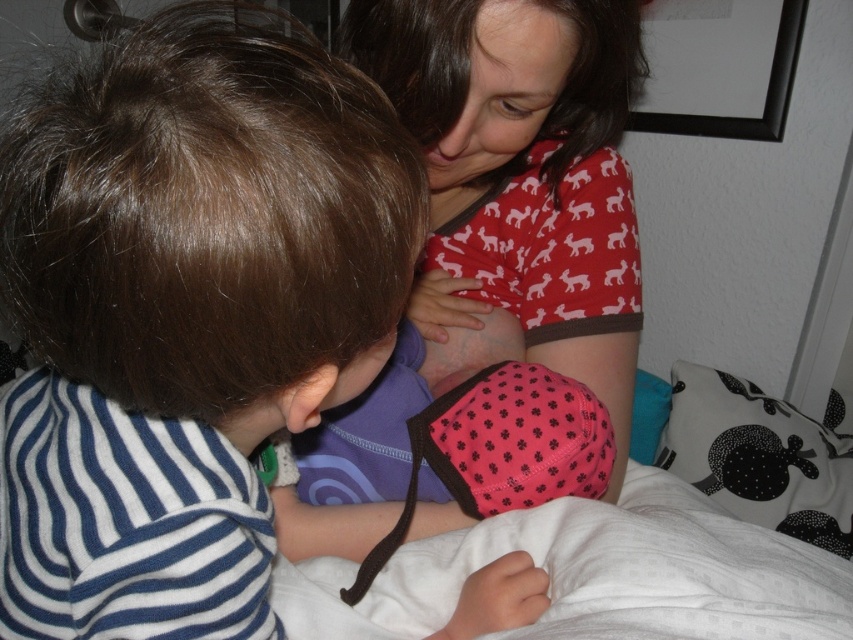
Question: Does striped cotton shirt at left have a smaller size compared to matte red shirt at upper center?

Choices:
 (A) no
 (B) yes

Answer: (B)

Question: Which of the following is the closest to the observer?

Choices:
 (A) (650, 428)
 (B) (477, 8)

Answer: (B)

Question: Can you confirm if matte red shirt at upper center is positioned above white fabric pillow at lower right?

Choices:
 (A) yes
 (B) no

Answer: (A)

Question: Is striped cotton shirt at left wider than matte red shirt at upper center?

Choices:
 (A) yes
 (B) no

Answer: (A)

Question: Which object is the farthest from the matte red shirt at upper center?

Choices:
 (A) white fabric pillow at lower right
 (B) striped cotton shirt at left

Answer: (A)

Question: Among these objects, which one is farthest from the camera?

Choices:
 (A) white fabric pillow at lower right
 (B) teal fabric pillow at lower right

Answer: (B)